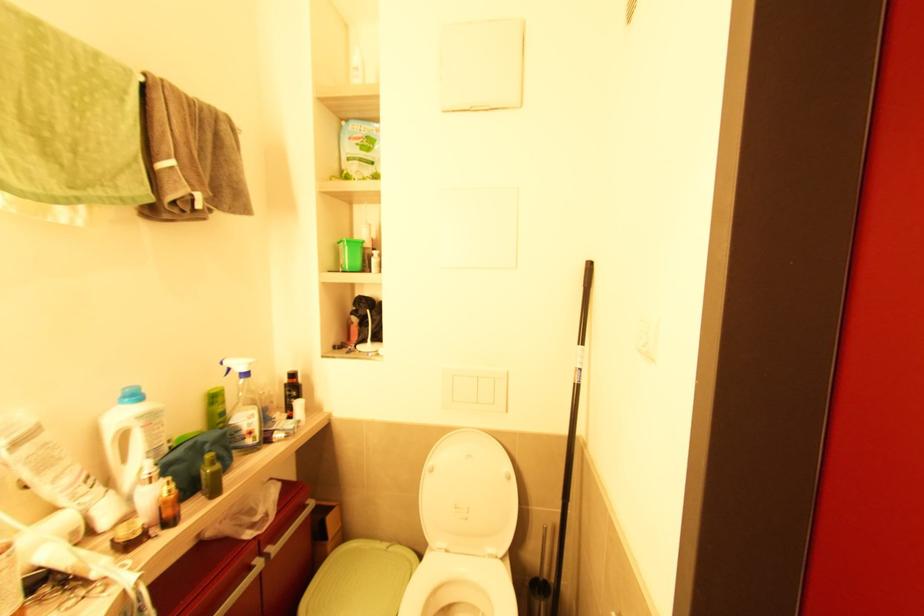
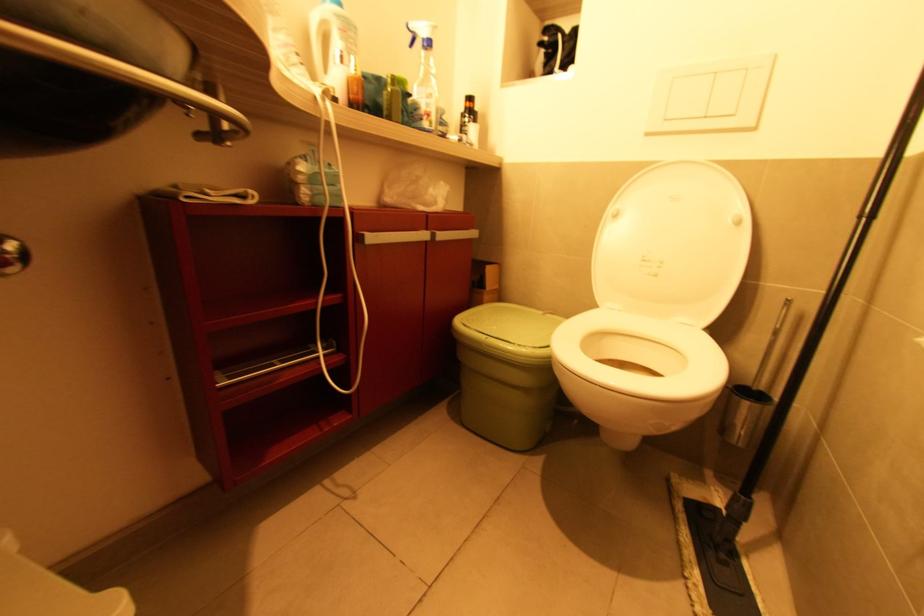
The point at (x=479, y=403) is marked in the first image. Where is the corresponding point in the second image?

(709, 118)